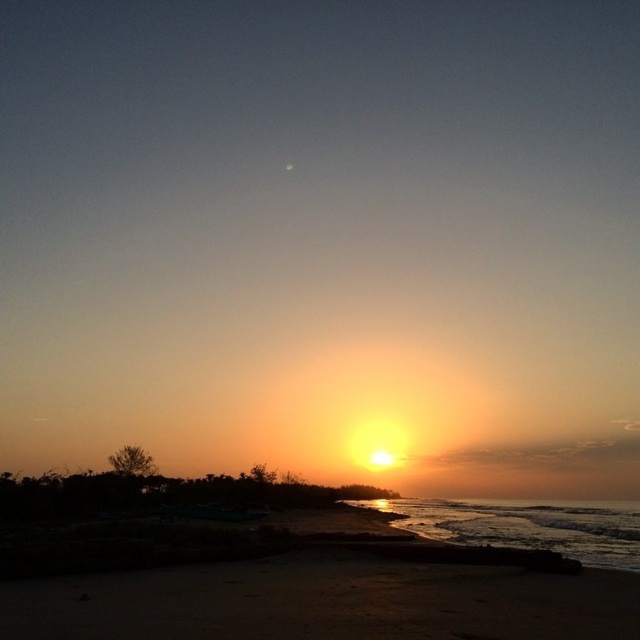
Is sandy beach at lower center further to camera compared to shiny metallic water at lower right?

No.

Can you confirm if sandy beach at lower center is taller than shiny metallic water at lower right?

Incorrect, sandy beach at lower center's height is not larger of shiny metallic water at lower right's.

Between point (397, 605) and point (480, 525), which one is positioned behind?

The point (480, 525) is behind.

Find the location of a particular element. This screenshot has height=640, width=640. sandy beach at lower center is located at coordinates (365, 586).